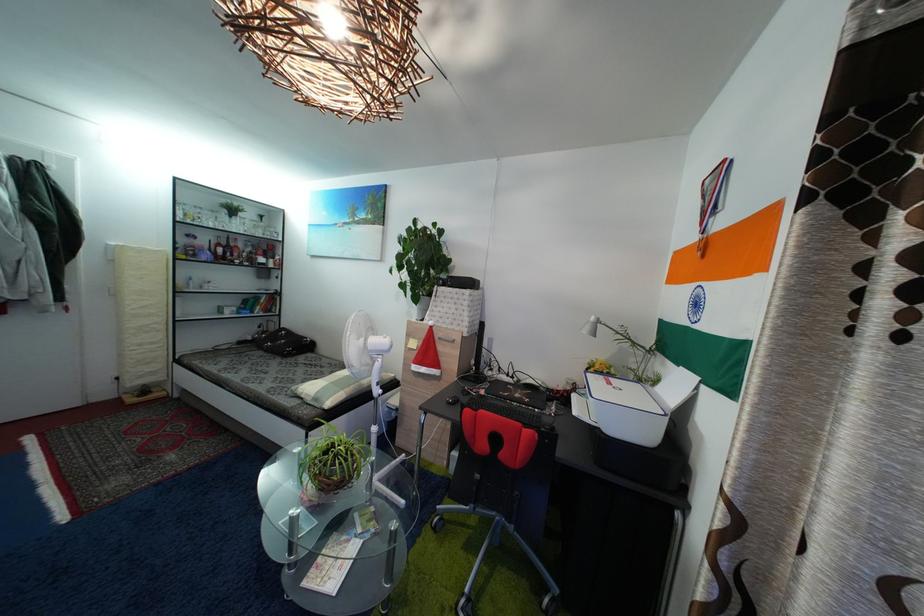
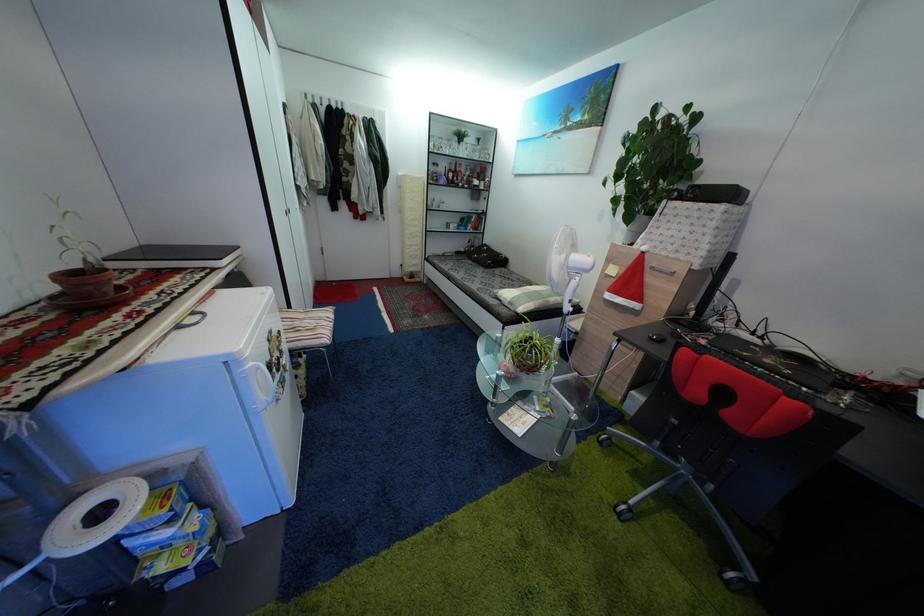
Locate, in the second image, the point that corresponds to the point at 203,245 in the first image.

(445, 172)